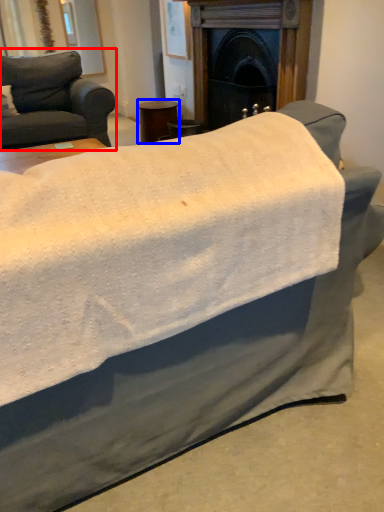
Question: Which of the following is the closest to the observer, studio couch (highlighted by a red box) or side table (highlighted by a blue box)?

Choices:
 (A) studio couch
 (B) side table

Answer: (A)